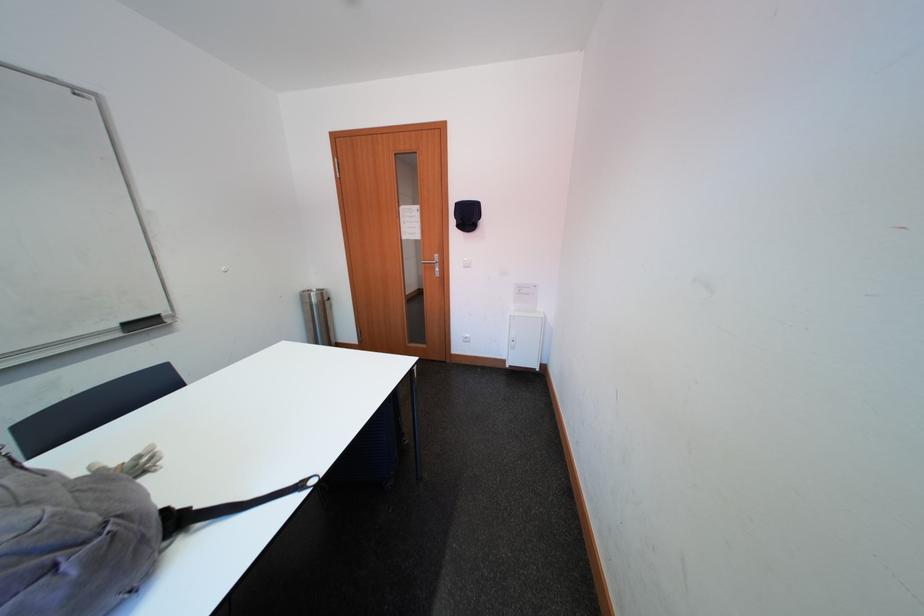
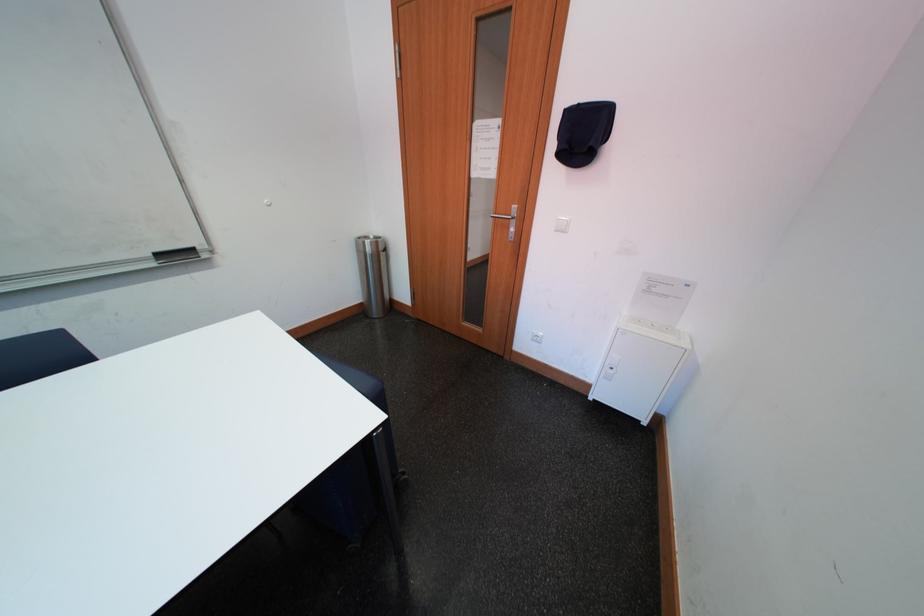
Question: The images are taken continuously from a first-person perspective. In which direction are you moving?

Choices:
 (A) Left
 (B) Right
 (C) Forward
 (D) Backward

Answer: (C)